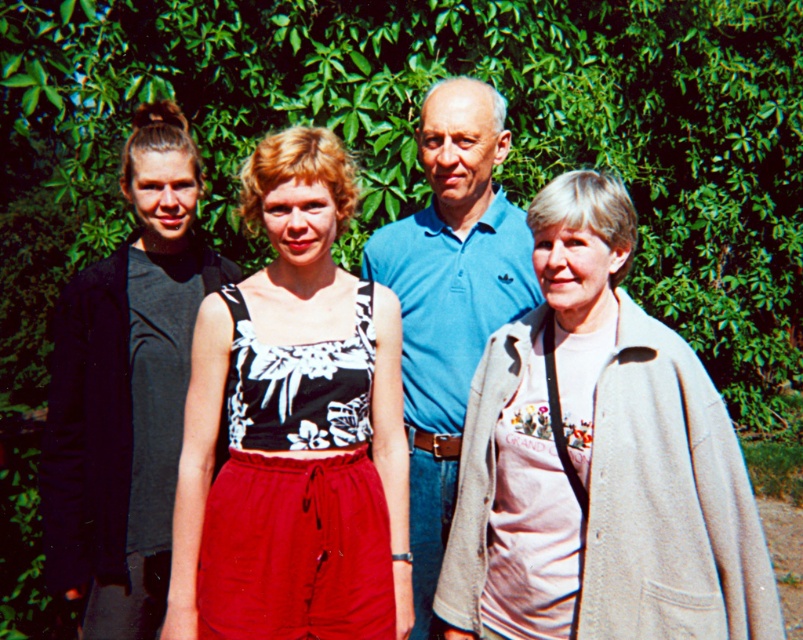
Question: Can you confirm if black floral tank top at center is wider than black matte tank top at left?

Choices:
 (A) no
 (B) yes

Answer: (B)

Question: Among these objects, which one is nearest to the camera?

Choices:
 (A) black matte tank top at left
 (B) black floral tank top at center
 (C) light beige woolen coat at center
 (D) blue cotton polo shirt at center

Answer: (C)

Question: Observing the image, what is the correct spatial positioning of light beige woolen coat at center in reference to black floral tank top at center?

Choices:
 (A) above
 (B) below

Answer: (B)

Question: Can you confirm if light beige woolen coat at center is wider than black floral tank top at center?

Choices:
 (A) no
 (B) yes

Answer: (B)

Question: Among these objects, which one is nearest to the camera?

Choices:
 (A) black floral tank top at center
 (B) blue cotton polo shirt at center
 (C) black matte tank top at left

Answer: (A)

Question: Which of the following is the closest to the observer?

Choices:
 (A) light beige woolen coat at center
 (B) blue cotton polo shirt at center
 (C) black matte tank top at left
 (D) black floral tank top at center

Answer: (A)